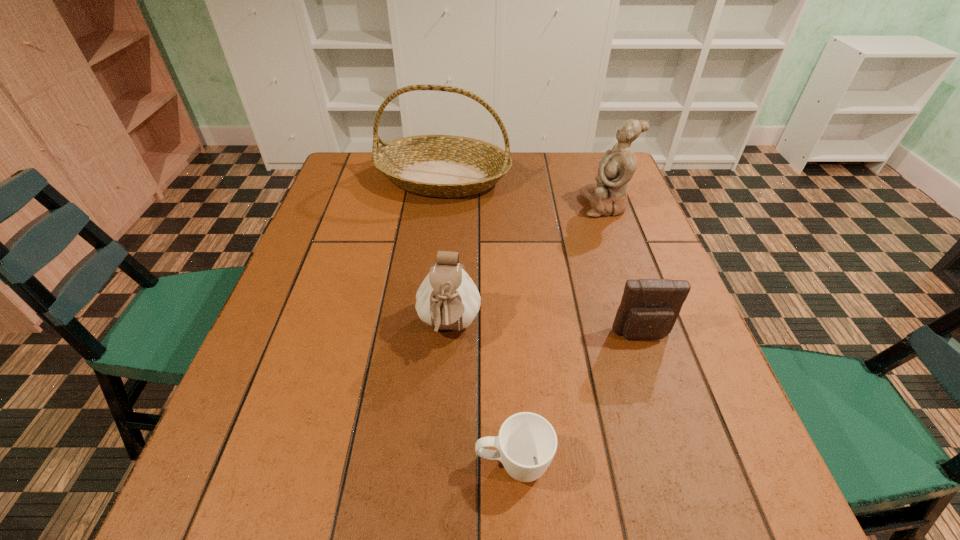
This screenshot has height=540, width=960. Identify the location of vacant space that's between the shortest object and the figurine. (559, 335).

At what (x,y) coordinates should I click in order to perform the action: click on free space between the shortest object and the third tallest object. Please return your answer as a coordinate pair (x, y). This screenshot has height=540, width=960. Looking at the image, I should click on (481, 396).

You are a GUI agent. You are given a task and a screenshot of the screen. Output one action in this format:
    pyautogui.click(x=<x>, y=<y>)
    Task: Click on the vacant region between the cup and the shorter pouch
    Image resolution: width=960 pixels, height=540 pixels.
    Given the screenshot: What is the action you would take?
    pyautogui.click(x=578, y=400)

The width and height of the screenshot is (960, 540). I want to click on empty space that is in between the basket and the figurine, so click(524, 192).

The height and width of the screenshot is (540, 960). Find the location of `empty space between the right pouch and the figurine`. empty space between the right pouch and the figurine is located at coordinates (624, 271).

The image size is (960, 540). Find the location of `unoccupied area between the right pouch and the basket`. unoccupied area between the right pouch and the basket is located at coordinates (542, 256).

Where is `empty space between the cup and the third tallest object`? This screenshot has height=540, width=960. empty space between the cup and the third tallest object is located at coordinates (481, 396).

Locate an element on the screen. empty space between the shortest object and the basket is located at coordinates (478, 321).

Locate an element on the screen. This screenshot has height=540, width=960. vacant point located between the figurine and the cup is located at coordinates (559, 335).

Choose which object is the second nearest neighbor to the taller pouch. Please provide its 2D coordinates. Your answer should be formatted as a tuple, i.e. [(x, y)], where the tuple contains the x and y coordinates of a point satisfying the conditions above.

[(649, 308)]